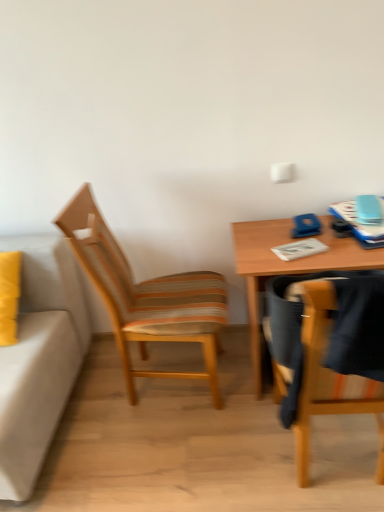
Question: Should I look upward or downward to see wooden table at right?

Choices:
 (A) down
 (B) up

Answer: (A)

Question: Could you tell me if woodenchair at left, positioned as the second chair in right-to-left order, is facing white paper notepad at center?

Choices:
 (A) yes
 (B) no

Answer: (A)

Question: Is the position of woodenchair at left, which is the second chair in front-to-back order, less distant than that of white paper notepad at center?

Choices:
 (A) no
 (B) yes

Answer: (B)

Question: From a real-world perspective, is woodenchair at left, which appears as the first chair when viewed from the left, over white paper notepad at center?

Choices:
 (A) yes
 (B) no

Answer: (B)

Question: Is woodenchair at left, the first chair when ordered from back to front, far from white paper notepad at center?

Choices:
 (A) no
 (B) yes

Answer: (A)

Question: Is woodenchair at left, the first chair when ordered from back to front, thinner than white paper notepad at center?

Choices:
 (A) yes
 (B) no

Answer: (B)

Question: Is woodenchair at left, the first chair when ordered from back to front, touching white paper notepad at center?

Choices:
 (A) no
 (B) yes

Answer: (A)

Question: Is woodenchair at left, positioned as the second chair in right-to-left order, further to camera compared to wooden table at right?

Choices:
 (A) yes
 (B) no

Answer: (B)

Question: Is woodenchair at left, positioned as the second chair in right-to-left order, turned away from wooden table at right?

Choices:
 (A) yes
 (B) no

Answer: (B)

Question: From a real-world perspective, is woodenchair at left, which is the second chair in front-to-back order, positioned over wooden table at right based on gravity?

Choices:
 (A) no
 (B) yes

Answer: (B)

Question: Considering the relative sizes of woodenchair at left, which appears as the first chair when viewed from the left, and wooden table at right in the image provided, is woodenchair at left, which appears as the first chair when viewed from the left, shorter than wooden table at right?

Choices:
 (A) yes
 (B) no

Answer: (B)

Question: From a real-world perspective, is woodenchair at left, positioned as the second chair in right-to-left order, beneath wooden table at right?

Choices:
 (A) yes
 (B) no

Answer: (B)

Question: Can you confirm if woodenchair at left, positioned as the second chair in right-to-left order, is positioned to the left of wooden table at right?

Choices:
 (A) no
 (B) yes

Answer: (B)

Question: Can you confirm if wooden chair at right, arranged as the 2th chair when viewed from the back, is taller than white paper notepad at center?

Choices:
 (A) no
 (B) yes

Answer: (B)